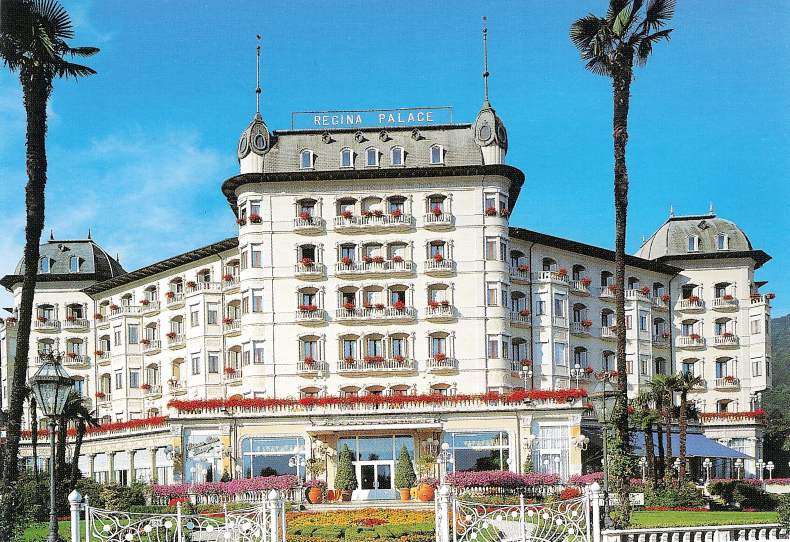
At what (x,y) coordinates should I click in order to perform the action: click on left door. Please return your answer as a coordinate pair (x, y). Looking at the image, I should click on (366, 469).